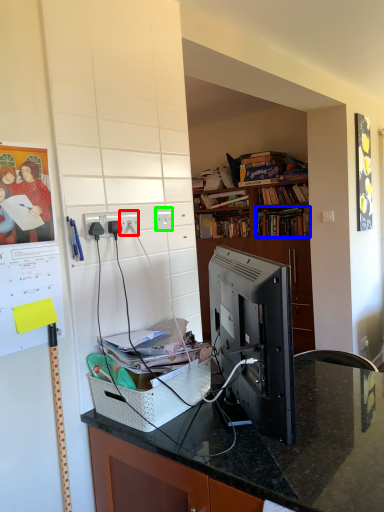
Question: Based on their relative distances, which object is nearer to electric outlet (highlighted by a red box)? Choose from book (highlighted by a blue box) and electric outlet (highlighted by a green box).

Choices:
 (A) book
 (B) electric outlet

Answer: (B)